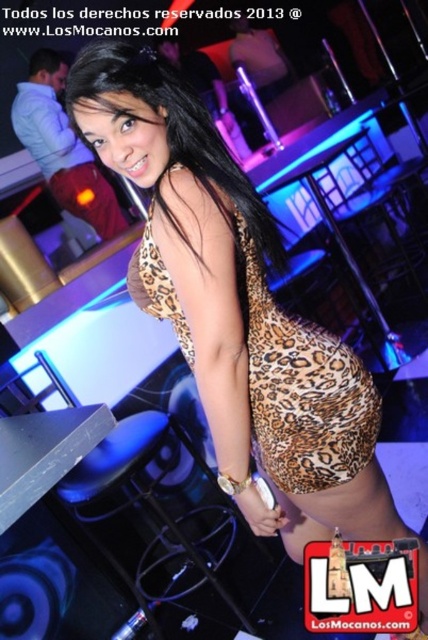
Does leopard print dress at center appear over matte black bartender at upper left?

Incorrect, leopard print dress at center is not positioned above matte black bartender at upper left.

Is leopard print dress at center below matte black bartender at upper left?

Yes.

Which is in front, point (294, 337) or point (97, 177)?

Point (294, 337) is in front.

At what (x,y) coordinates should I click in order to perform the action: click on leopard print dress at center. Please return your answer as a coordinate pair (x, y). Looking at the image, I should click on (300, 387).